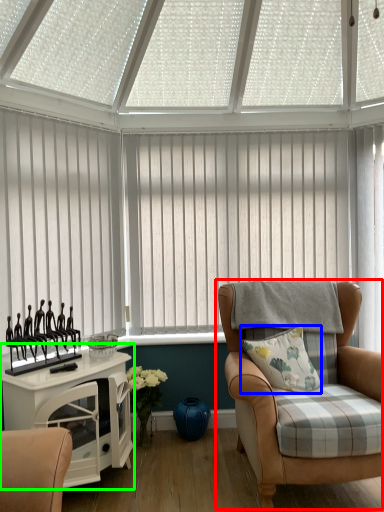
Question: Which is farther away from chair (highlighted by a red box)? pillow (highlighted by a blue box) or table (highlighted by a green box)?

Choices:
 (A) pillow
 (B) table

Answer: (B)